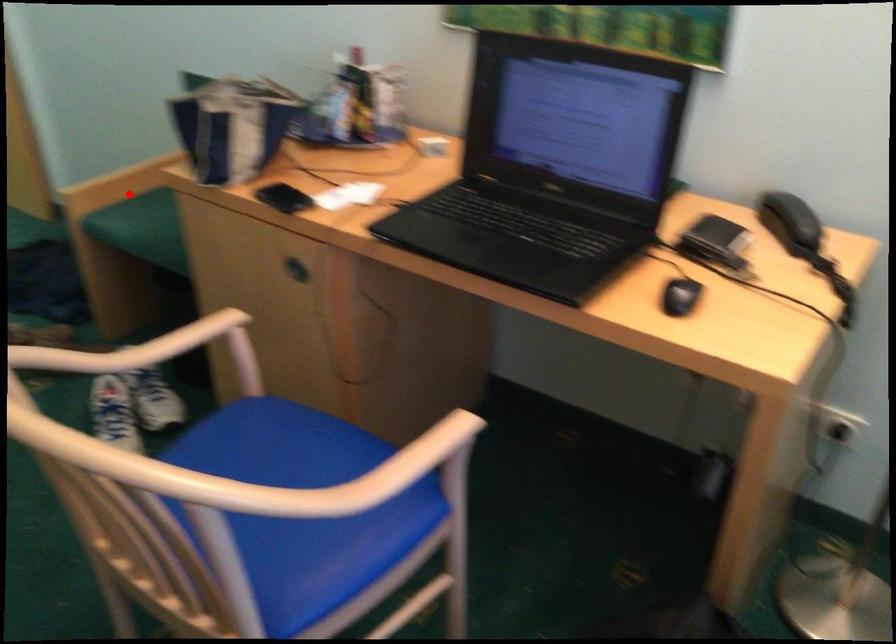
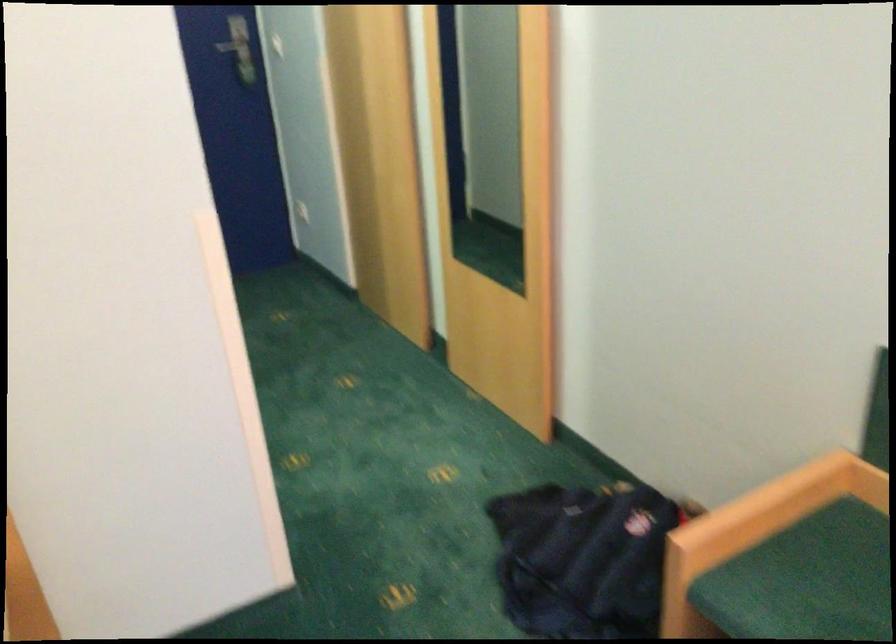
Question: A red point is marked in image1. In image2, is the corresponding 3D point closer to the camera or farther? Reply with the corresponding letter.

Choices:
 (A) The corresponding 3D point is closer.
 (B) The corresponding 3D point is farther.

Answer: (A)